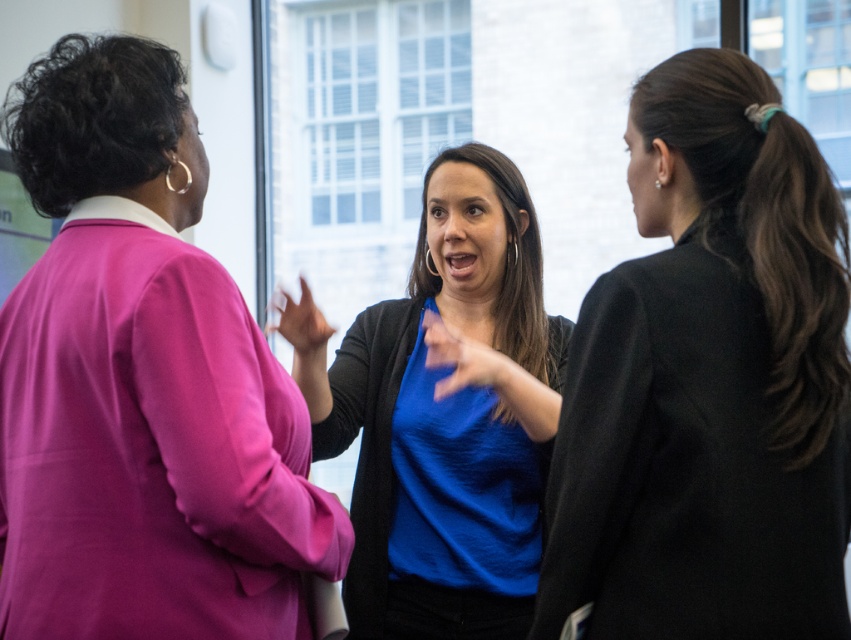
Can you confirm if matte pink blazer at left is bigger than blue matte shirt at center?

Actually, matte pink blazer at left might be smaller than blue matte shirt at center.

Does matte pink blazer at left come behind blue matte shirt at center?

No, matte pink blazer at left is in front of blue matte shirt at center.

What do you see at coordinates (141, 384) in the screenshot? I see `matte pink blazer at left` at bounding box center [141, 384].

The width and height of the screenshot is (851, 640). In order to click on matte pink blazer at left in this screenshot , I will do `click(141, 384)`.

Is point (156, 483) farther from camera compared to point (732, 600)?

Yes, it is behind point (732, 600).

Is matte pink blazer at left smaller than black matte blazer at right?

Incorrect, matte pink blazer at left is not smaller in size than black matte blazer at right.

Is point (47, 67) positioned in front of point (660, 236)?

No.

Locate an element on the screen. This screenshot has height=640, width=851. matte pink blazer at left is located at coordinates (141, 384).

In the scene shown: Does black matte blazer at right come behind blue matte shirt at center?

No, it is in front of blue matte shirt at center.

Does black matte blazer at right have a lesser height compared to blue matte shirt at center?

Yes.

At what (x,y) coordinates should I click in order to perform the action: click on black matte blazer at right. Please return your answer as a coordinate pair (x, y). Looking at the image, I should click on (709, 381).